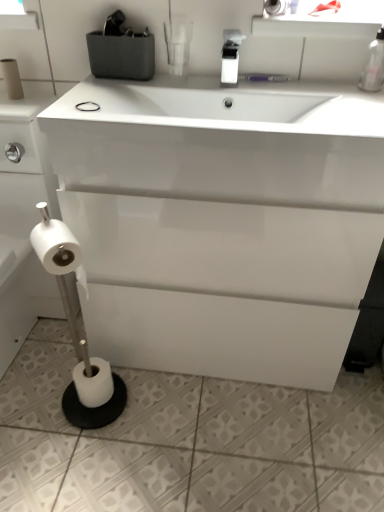
Where is `free location in front of white matte toilet paper at lower left, the 2th toilet paper viewed from the right`? This screenshot has width=384, height=512. free location in front of white matte toilet paper at lower left, the 2th toilet paper viewed from the right is located at coordinates (84, 447).